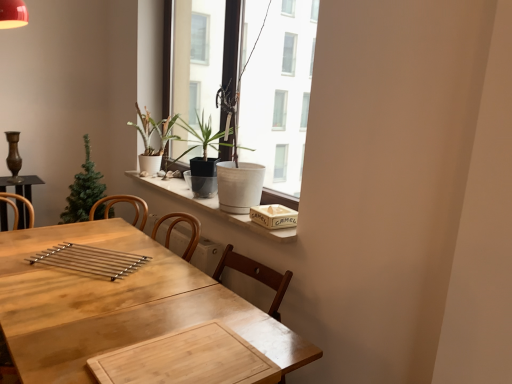
Question: Do you think green matte christmas tree at left, the 3th houseplant in the right-to-left sequence, is within white marble window sill at upper center, or outside of it?

Choices:
 (A) inside
 (B) outside

Answer: (B)

Question: Would you say green matte christmas tree at left, the 3th houseplant in the right-to-left sequence, is to the left or to the right of white marble window sill at upper center in the picture?

Choices:
 (A) left
 (B) right

Answer: (A)

Question: Which is farther from the white marble window sill at upper center?

Choices:
 (A) white matte pot at upper center
 (B) wooden textured book at upper right
 (C) matte black pot at center, positioned as the first houseplant in right-to-left order
 (D) matte white pot at window, the 2th houseplant viewed from the right
 (E) green matte christmas tree at left, the 3th houseplant in the right-to-left sequence

Answer: (A)

Question: Which object is the farthest from the wooden table at center?

Choices:
 (A) wooden textured book at upper right
 (B) polished metal tray at center
 (C) white marble window sill at upper center
 (D) white matte pot at upper center
 (E) matte white pot at window, the 2th houseplant viewed from the right

Answer: (D)